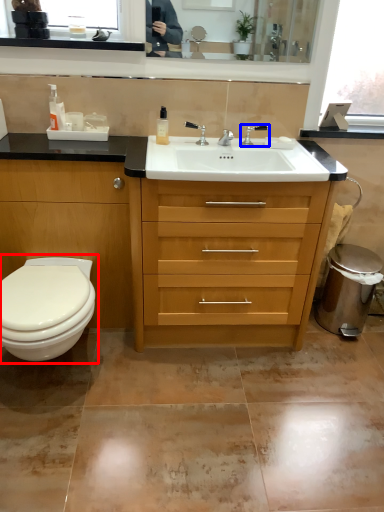
Question: Which object is further to the camera taking this photo, toilet (highlighted by a red box) or tap (highlighted by a blue box)?

Choices:
 (A) toilet
 (B) tap

Answer: (B)